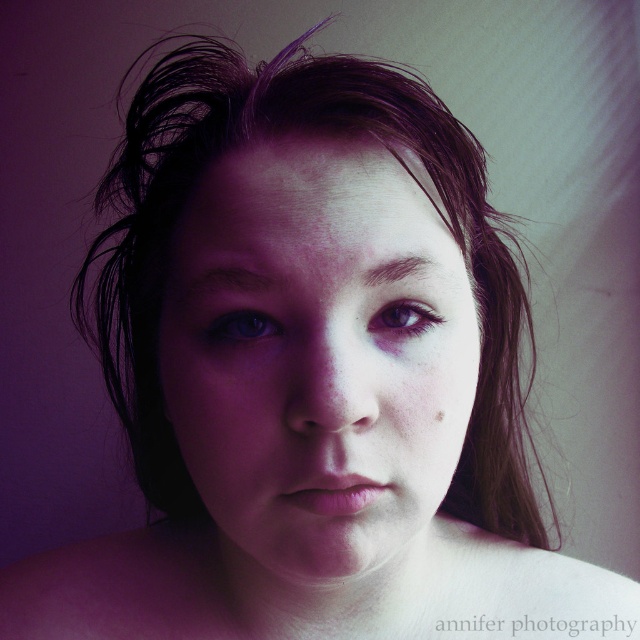
Based on the scene description, can you determine if the smooth skin face at center is wider than the purple matte eye at center?

The smooth skin face at center is wider than the purple matte eye at center according to the objects description.

What are the coordinates of the blue glossy eye at center in the image?

The blue glossy eye at center is located at coordinates point (241,326).